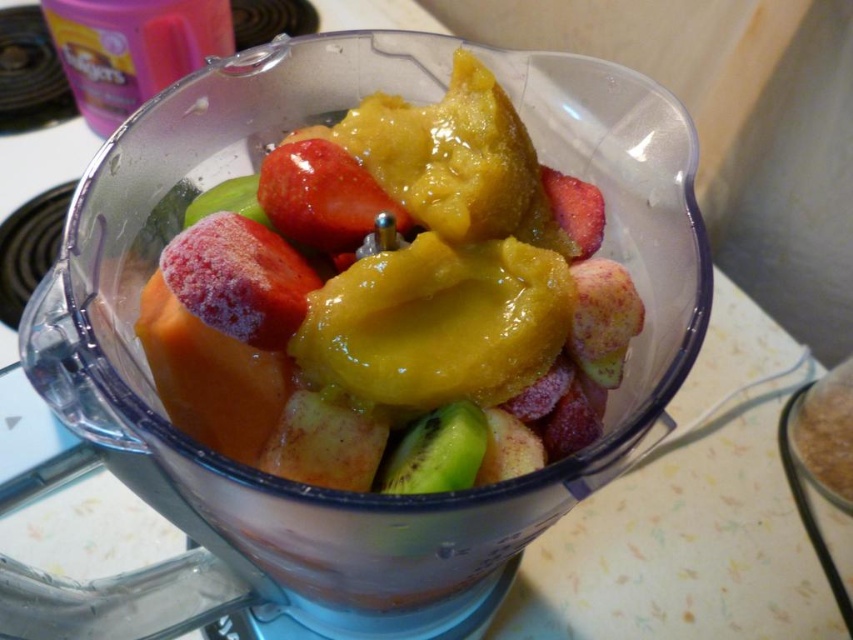
Question: Estimate the real-world distances between objects in this image. Which object is farther from the green matte kiwi at center?

Choices:
 (A) shiny red strawberry at center
 (B) glossy plastic blender at center

Answer: (A)

Question: Is the position of shiny red strawberry at center less distant than that of green matte kiwi at center?

Choices:
 (A) no
 (B) yes

Answer: (A)

Question: Which object appears farthest from the camera in this image?

Choices:
 (A) shiny red strawberry at center
 (B) glossy plastic blender at center
 (C) green matte kiwi at center

Answer: (A)

Question: Can you confirm if glossy plastic blender at center is positioned to the left of green matte kiwi at center?

Choices:
 (A) no
 (B) yes

Answer: (B)

Question: Which of these objects is positioned farthest from the green matte kiwi at center?

Choices:
 (A) shiny red strawberry at center
 (B) glossy plastic blender at center

Answer: (A)

Question: Can you confirm if shiny red strawberry at center is bigger than green matte kiwi at center?

Choices:
 (A) no
 (B) yes

Answer: (B)